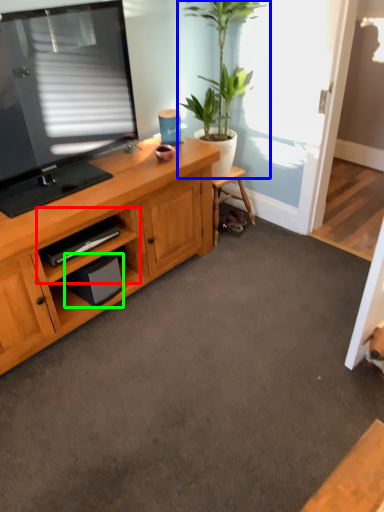
Question: Based on their relative distances, which object is farther from cabinet (highlighted by a red box)? Choose from houseplant (highlighted by a blue box) and speaker (highlighted by a green box).

Choices:
 (A) houseplant
 (B) speaker

Answer: (A)